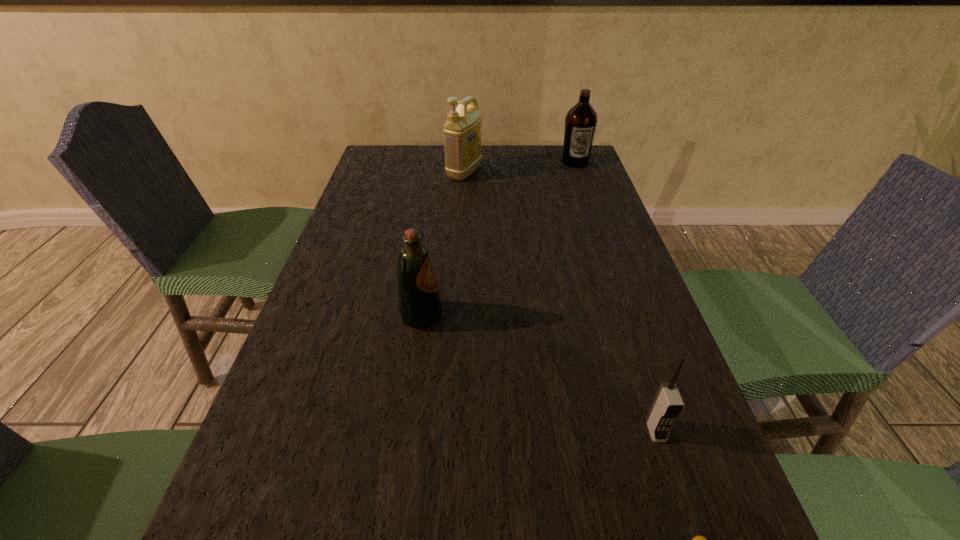
Image resolution: width=960 pixels, height=540 pixels. I want to click on free space between the left olive oil and the second shortest object, so (x=539, y=373).

Locate an element on the screen. This screenshot has width=960, height=540. free area in between the nearer olive oil and the detergent is located at coordinates (443, 244).

Image resolution: width=960 pixels, height=540 pixels. What are the coordinates of `free space between the nearer olive oil and the fourth tallest object` in the screenshot? It's located at (539, 373).

Identify the location of unoccupied area between the detergent and the cellular telephone. (560, 302).

Select which object appears as the second closest to the fourth farthest object. Please provide its 2D coordinates. Your answer should be formatted as a tuple, i.e. [(x, y)], where the tuple contains the x and y coordinates of a point satisfying the conditions above.

[(419, 303)]

The image size is (960, 540). Identify the location of object identified as the second closest to the detergent. pyautogui.click(x=419, y=303).

At what (x,y) coordinates should I click in order to perform the action: click on vacant space that satisfies the following two spatial constraints: 1. on the label of the right olive oil; 2. on the front-facing side of the third nearest object. Please return your answer as a coordinate pair (x, y). Looking at the image, I should click on (629, 315).

The width and height of the screenshot is (960, 540). I want to click on vacant space that satisfies the following two spatial constraints: 1. on the label of the right olive oil; 2. on the front-facing side of the third farthest object, so click(629, 315).